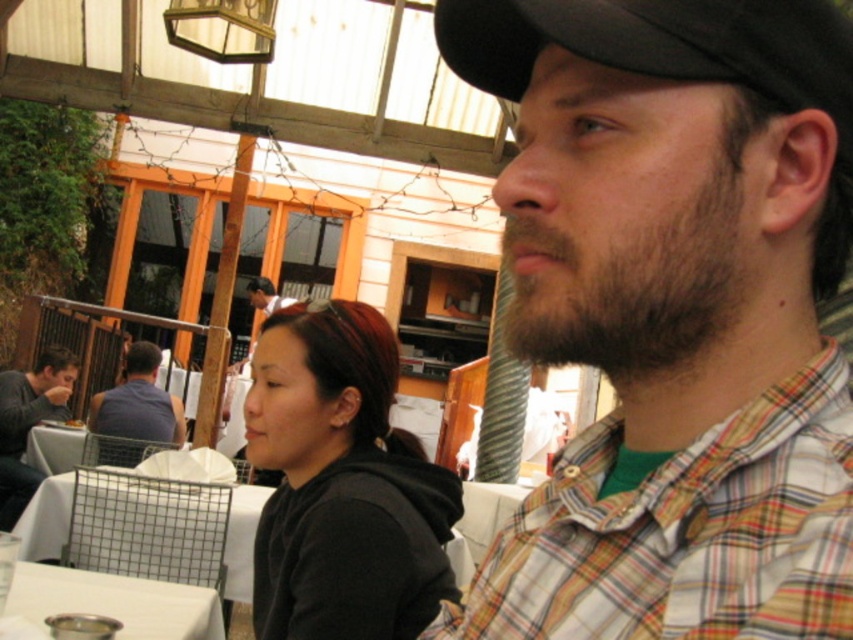
You are a server at the restaurant and need to place a 1.2 meter wide tray on either the white mesh table at lower left or the matte black shirt at center. Based on their widths, which object can accommodate the tray?

The matte black shirt at center has a greater width than the white mesh table at lower left, so the tray can be placed on the matte black shirt at center.

You are a server in the dining establishment and need to place a large dessert plate on either the white mesh table at lower left or the matte black shirt at center. Which surface is more appropriate for placing the dessert plate?

The matte black shirt at center is more appropriate for placing the dessert plate since the white mesh table at lower left has a smaller size compared to matte black shirt at center.